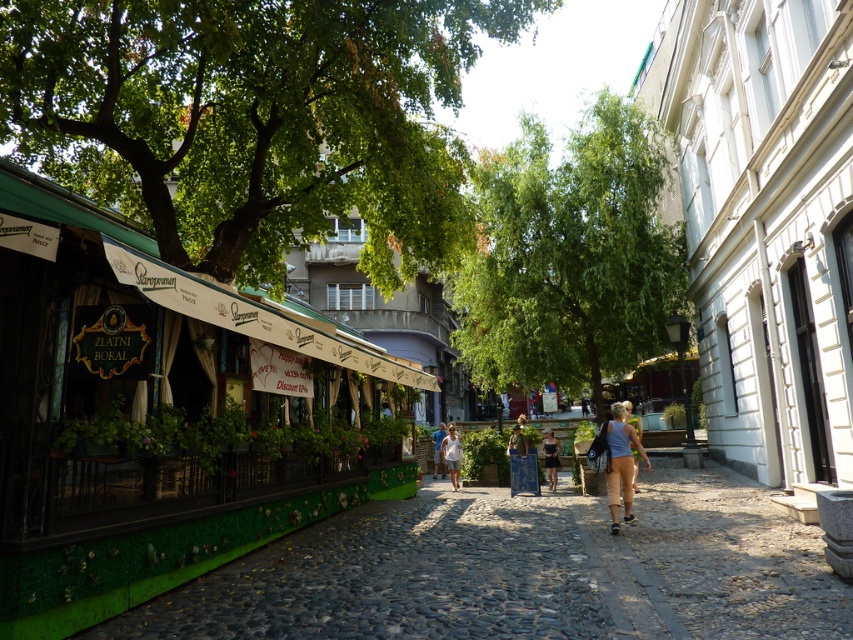
From the picture: You are standing at the point with coordinates point (x=437, y=428) and want to walk to the point (x=233, y=365). According to the scene description, will you be moving towards the restaurant Zlatni Bokal located on the left side of the image?

Yes, moving from point (x=437, y=428) to point (x=233, y=365) means you are moving towards the restaurant Zlatni Bokal on the left side since the starting point is behind the destination point, which is in front of it.

Looking at this image, you are standing at the point labeled point (643, 282) and want to walk to the point labeled point (189, 512). According to the scene description, which direction should you move to reach your destination?

You should move forward because point (189, 512) is in front of point (643, 282).

You are standing on the cobblestone pathway in the charming European street scene. You notice the restaurant named Zlatni Bokal with its green facade and floral patterns. Now, you see a point marked at coordinates (621, 464). What object is located at this point?

The point at coordinates (621, 464) marks the location of light brown fabric shorts at lower right.